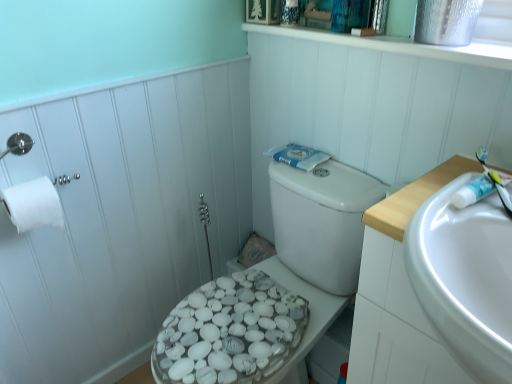
Question: Would you say white pebble-patterned toilet seat at left is part of white matte toilet paper at left's contents?

Choices:
 (A) yes
 (B) no

Answer: (B)

Question: Is white matte toilet paper at left outside white pebble-patterned toilet seat at left?

Choices:
 (A) yes
 (B) no

Answer: (A)

Question: Does white matte toilet paper at left appear on the left side of white pebble-patterned toilet seat at left?

Choices:
 (A) yes
 (B) no

Answer: (A)

Question: Could you tell me if white matte toilet paper at left is turned towards white pebble-patterned toilet seat at left?

Choices:
 (A) no
 (B) yes

Answer: (A)

Question: Considering the relative sizes of white matte toilet paper at left and white pebble-patterned toilet seat at left in the image provided, is white matte toilet paper at left wider than white pebble-patterned toilet seat at left?

Choices:
 (A) no
 (B) yes

Answer: (B)

Question: From a real-world perspective, is white plastic toothbrush at right physically located above or below white pebble-patterned toilet seat at left?

Choices:
 (A) below
 (B) above

Answer: (B)

Question: Is white plastic toothbrush at right situated inside white pebble-patterned toilet seat at left or outside?

Choices:
 (A) outside
 (B) inside

Answer: (A)

Question: From the image's perspective, is white plastic toothbrush at right located above or below white pebble-patterned toilet seat at left?

Choices:
 (A) above
 (B) below

Answer: (A)

Question: Looking at their shapes, would you say white plastic toothbrush at right is wider or thinner than white pebble-patterned toilet seat at left?

Choices:
 (A) thin
 (B) wide

Answer: (B)

Question: Is white plastic toothbrush at right wider or thinner than white matte toilet paper at left?

Choices:
 (A) thin
 (B) wide

Answer: (B)

Question: Does point (484, 155) appear closer or farther from the camera than point (10, 215)?

Choices:
 (A) closer
 (B) farther

Answer: (A)

Question: Is white plastic toothbrush at right in front of or behind white matte toilet paper at left in the image?

Choices:
 (A) behind
 (B) front

Answer: (B)

Question: Based on their positions, is white plastic toothbrush at right located to the left or right of white matte toilet paper at left?

Choices:
 (A) right
 (B) left

Answer: (A)

Question: Considering their positions, is white glossy sink at right located in front of or behind white pebble-patterned toilet seat at left?

Choices:
 (A) front
 (B) behind

Answer: (A)

Question: Is white glossy sink at right inside the boundaries of white pebble-patterned toilet seat at left, or outside?

Choices:
 (A) inside
 (B) outside

Answer: (B)